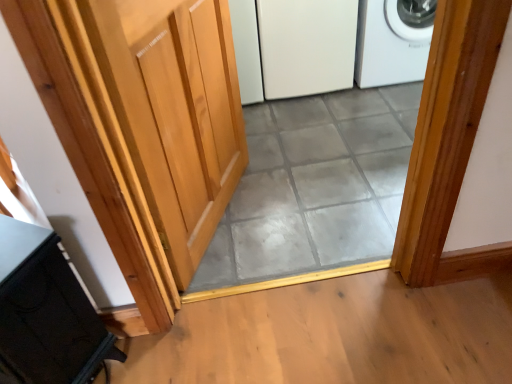
The image size is (512, 384). I want to click on unoccupied space behind light wood door at center, so click(271, 142).